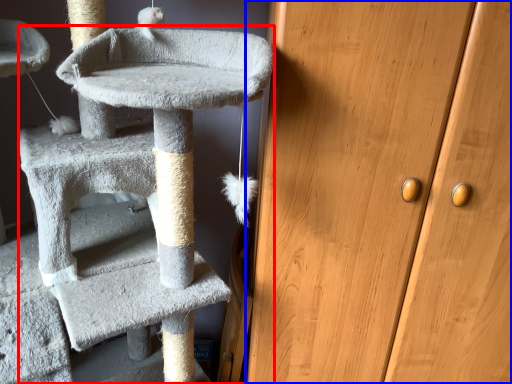
Question: Among these objects, which one is nearest to the camera, cat furniture (highlighted by a red box) or door (highlighted by a blue box)?

Choices:
 (A) cat furniture
 (B) door

Answer: (A)